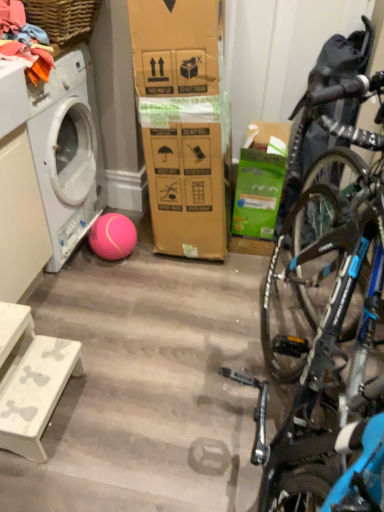
Locate an element on the screen. Image resolution: width=384 pixels, height=512 pixels. white marble step stool at lower left is located at coordinates (30, 380).

The height and width of the screenshot is (512, 384). Describe the element at coordinates (30, 380) in the screenshot. I see `white marble step stool at lower left` at that location.

Image resolution: width=384 pixels, height=512 pixels. Identify the location of white matte washing machine at left. (67, 152).

The height and width of the screenshot is (512, 384). Describe the element at coordinates (260, 180) in the screenshot. I see `green cardboard box at center-right` at that location.

Where is `white marble step stool at lower left`? The height and width of the screenshot is (512, 384). white marble step stool at lower left is located at coordinates (30, 380).

Considering the positions of point (53, 158) and point (11, 350), is point (53, 158) closer or farther from the camera than point (11, 350)?

Clearly, point (53, 158) is more distant from the camera than point (11, 350).

Is white matte washing machine at left aimed at white marble step stool at lower left?

No, white matte washing machine at left does not turn towards white marble step stool at lower left.

Image resolution: width=384 pixels, height=512 pixels. I want to click on washing machine located above the white marble step stool at lower left (from a real-world perspective), so [67, 152].

Is woven wood picnic basket at upper left at the left side of green cardboard box at center-right?

Indeed, woven wood picnic basket at upper left is positioned on the left side of green cardboard box at center-right.

This screenshot has height=512, width=384. In order to click on picnic basket above the green cardboard box at center-right (from the image's perspective) in this screenshot , I will do `click(63, 18)`.

Do you think woven wood picnic basket at upper left is within green cardboard box at center-right, or outside of it?

woven wood picnic basket at upper left is not inside green cardboard box at center-right, it's outside.

Measure the distance between woven wood picnic basket at upper left and green cardboard box at center-right.

woven wood picnic basket at upper left is 36.54 inches away from green cardboard box at center-right.

Is point (29, 440) behind point (33, 73)?

No, it is in front of (33, 73).

Considering the sizes of objects white marble step stool at lower left and soft cotton clothes at upper left in the image provided, who is bigger, white marble step stool at lower left or soft cotton clothes at upper left?

Bigger between the two is white marble step stool at lower left.

How different are the orientations of white marble step stool at lower left and soft cotton clothes at upper left in degrees?

They differ by 3.36 degrees in their facing directions.

Which of these two, white marble step stool at lower left or soft cotton clothes at upper left, stands shorter?

Standing shorter between the two is soft cotton clothes at upper left.

Is point (9, 398) less distant than point (44, 123)?

Yes, point (9, 398) is closer to viewer.

From a real-world perspective, is white marble step stool at lower left above or below white matte washing machine at left?

Clearly, from a real-world perspective, white marble step stool at lower left is below white matte washing machine at left.

Is white marble step stool at lower left closer to the viewer compared to white matte washing machine at left?

Yes, it is in front of white matte washing machine at left.

Which of these two, white marble step stool at lower left or white matte washing machine at left, is bigger?

white matte washing machine at left is bigger.

Where is `clothing that is on the left side of green cardboard box at center-right`? clothing that is on the left side of green cardboard box at center-right is located at coordinates (23, 41).

Which object is closer to the camera, green cardboard box at center-right or soft cotton clothes at upper left?

Positioned in front is soft cotton clothes at upper left.

Is green cardboard box at center-right turned away from soft cotton clothes at upper left?

green cardboard box at center-right does not have its back to soft cotton clothes at upper left.

From the image's perspective, which one is positioned higher, green cardboard box at center-right or soft cotton clothes at upper left?

From the image's view, soft cotton clothes at upper left is above.

Can you confirm if soft cotton clothes at upper left is positioned to the left of white marble step stool at lower left?

Indeed, soft cotton clothes at upper left is positioned on the left side of white marble step stool at lower left.

Which object is further away from the camera taking this photo, soft cotton clothes at upper left or white marble step stool at lower left?

soft cotton clothes at upper left is behind.

Can you confirm if soft cotton clothes at upper left is taller than white marble step stool at lower left?

In fact, soft cotton clothes at upper left may be shorter than white marble step stool at lower left.

Is green cardboard box at center-right completely or partially outside of woven wood picnic basket at upper left?

green cardboard box at center-right is positioned outside woven wood picnic basket at upper left.

Considering the sizes of objects green cardboard box at center-right and woven wood picnic basket at upper left in the image provided, who is shorter, green cardboard box at center-right or woven wood picnic basket at upper left?

woven wood picnic basket at upper left is shorter.

Based on the photo, does green cardboard box at center-right appear on the right side of woven wood picnic basket at upper left?

Indeed, green cardboard box at center-right is positioned on the right side of woven wood picnic basket at upper left.

From a real-world perspective, does green cardboard box at center-right stand above woven wood picnic basket at upper left?

No, from a real-world perspective, green cardboard box at center-right is not above woven wood picnic basket at upper left.

Locate an element on the screen. This screenshot has height=512, width=384. furniture below the white matte washing machine at left (from the image's perspective) is located at coordinates (30, 380).

This screenshot has height=512, width=384. Identify the location of picnic basket lying above the green cardboard box at center-right (from the image's perspective). (63, 18).

Considering their positions, is woven wood picnic basket at upper left positioned further to green cardboard box at center-right than soft cotton clothes at upper left?

Among the two, soft cotton clothes at upper left is located further to green cardboard box at center-right.

Looking at the image, which one is located closer to soft cotton clothes at upper left, white marble step stool at lower left or white matte washing machine at left?

white matte washing machine at left lies closer to soft cotton clothes at upper left than the other object.

Based on their spatial positions, is soft cotton clothes at upper left or woven wood picnic basket at upper left further from green cardboard box at center-right?

soft cotton clothes at upper left is positioned further to the anchor green cardboard box at center-right.

Estimate the real-world distances between objects in this image. Which object is closer to green cardboard box at center-right, white marble step stool at lower left or soft cotton clothes at upper left?

soft cotton clothes at upper left.

Looking at the image, which one is located closer to green cardboard box at center-right, woven wood picnic basket at upper left or white matte washing machine at left?

Among the two, white matte washing machine at left is located nearer to green cardboard box at center-right.

From the picture: When comparing their distances from woven wood picnic basket at upper left, does white matte washing machine at left or green cardboard box at center-right seem closer?

white matte washing machine at left is positioned closer to the anchor woven wood picnic basket at upper left.

From the image, which object appears to be farther from woven wood picnic basket at upper left, green cardboard box at center-right or white marble step stool at lower left?

white marble step stool at lower left is further to woven wood picnic basket at upper left.

When comparing their distances from white matte washing machine at left, does woven wood picnic basket at upper left or white marble step stool at lower left seem further?

Based on the image, white marble step stool at lower left appears to be further to white matte washing machine at left.

The width and height of the screenshot is (384, 512). Identify the location of washing machine between woven wood picnic basket at upper left and white marble step stool at lower left in the vertical direction. (67, 152).

Identify the location of furniture between white matte washing machine at left and green cardboard box at center-right in the horizontal direction. (30, 380).

You are a GUI agent. You are given a task and a screenshot of the screen. Output one action in this format:
    pyautogui.click(x=<x>, y=<y>)
    Task: Click on the clothing between woven wood picnic basket at upper left and white matte washing machine at left in the up-down direction
    This screenshot has height=512, width=384.
    Given the screenshot: What is the action you would take?
    pyautogui.click(x=23, y=41)

At what (x,y) coordinates should I click in order to perform the action: click on picnic basket between white matte washing machine at left and green cardboard box at center-right from left to right. Please return your answer as a coordinate pair (x, y). Looking at the image, I should click on (63, 18).